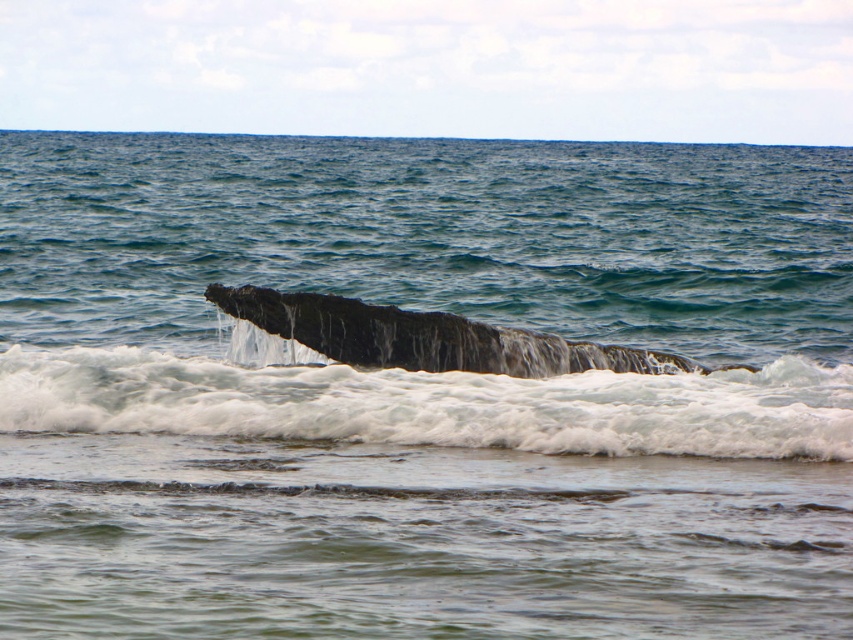
You are a marine biologist observing the coastal scene. You notice the dark gray textured rock at center and the dark gray textured whale at center. Which object is closer to the observer in this scene?

The dark gray textured rock at center is closer to the observer because it is in front of the dark gray textured whale at center.

You are a marine biologist studying coastal erosion. You are standing at the shoreline and notice the dark gray textured rock at center. Based on its position, can you estimate its location relative to the breaking wave in the scene?

The dark gray textured rock at center is positioned at coordinates point [432,404], which places it in the middle ground of the scene, likely between the breaking wave and the calm shallow waters.

You are standing on the beach and see the dark gray textured rock at center. If you want to reach it without getting wet, what is the minimum distance you need to walk from your current position?

The dark gray textured rock at center is 11.64 meters from the viewer, so you need to walk at least 11.64 meters to reach it without getting wet.